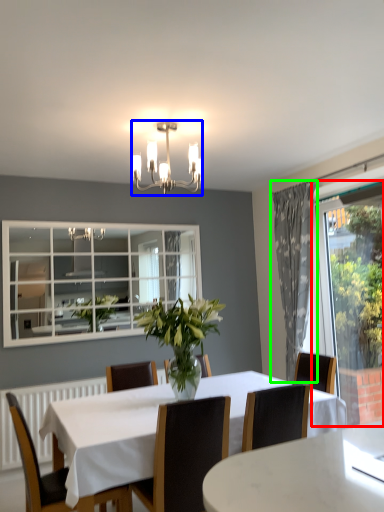
Question: Which object is the farthest from window screen (highlighted by a red box)? Choose among these: lamp (highlighted by a blue box) or curtain (highlighted by a green box).

Choices:
 (A) lamp
 (B) curtain

Answer: (A)